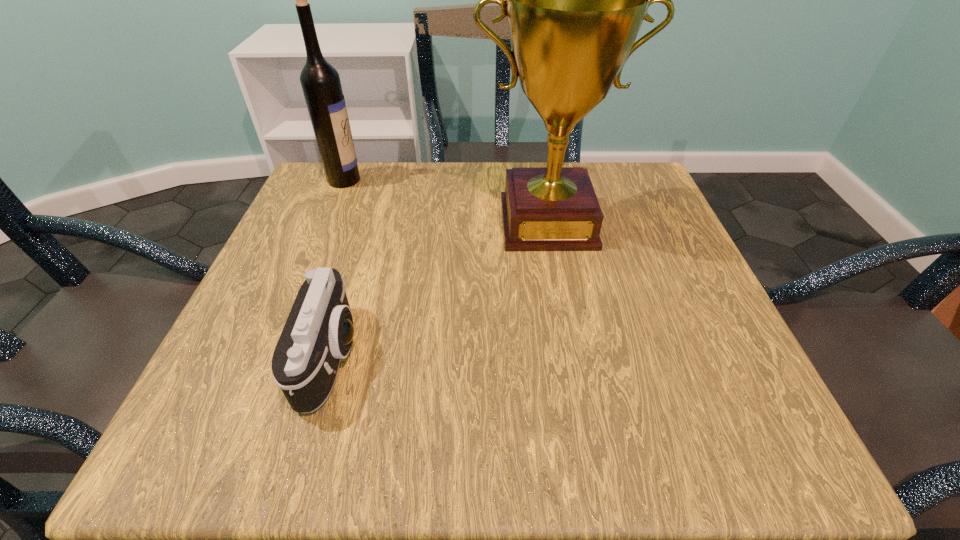
This screenshot has width=960, height=540. In order to click on award in this screenshot , I will do `click(575, 0)`.

Where is `the second farthest object`? the second farthest object is located at coordinates (575, 0).

What are the coordinates of `the leftmost object` in the screenshot? It's located at (320, 81).

Identify the location of the farthest object. The image size is (960, 540). (320, 81).

Where is `camera`? The height and width of the screenshot is (540, 960). camera is located at coordinates (318, 332).

Find the location of a particular element. This screenshot has width=960, height=540. the shortest object is located at coordinates tap(318, 332).

The image size is (960, 540). What are the coordinates of `free point located 0.080m on the plaque of the second nearest object` in the screenshot? It's located at (559, 285).

Where is `vacant space located 0.280m on the label of the farthest object`? The width and height of the screenshot is (960, 540). vacant space located 0.280m on the label of the farthest object is located at coordinates (482, 179).

Where is `free space located on the front lens of the second object from right to left`? The image size is (960, 540). free space located on the front lens of the second object from right to left is located at coordinates (601, 356).

Locate an element on the screen. award that is positioned at the far edge is located at coordinates (575, 0).